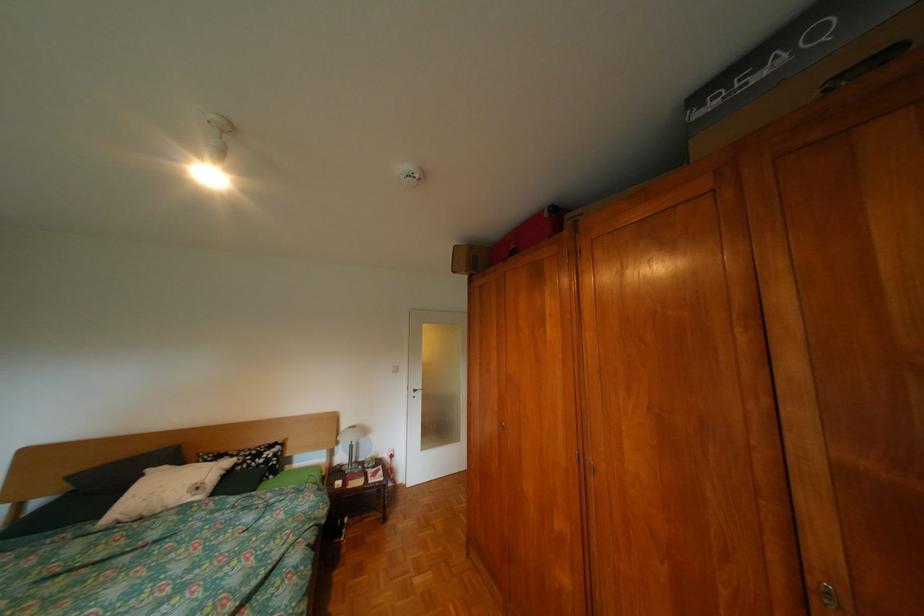
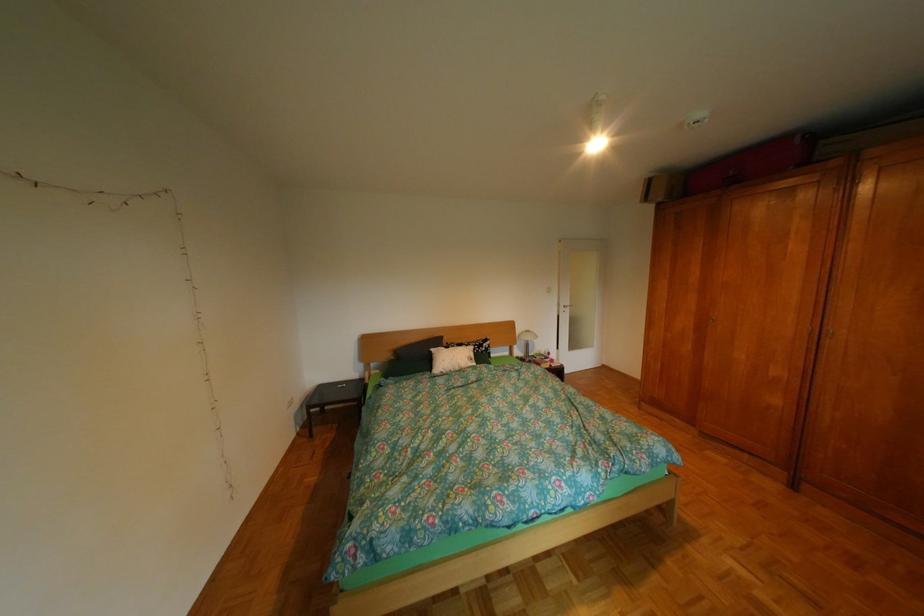
In a continuous first-person perspective shot, in which direction is the camera moving?

The movement direction of the cameraman is left, backward.